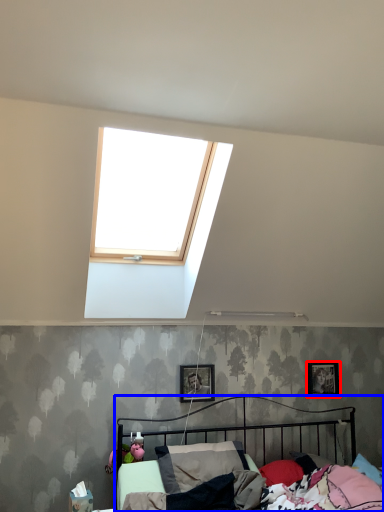
Question: Which of the following is the closest to the observer, picture frame (highlighted by a red box) or bed (highlighted by a blue box)?

Choices:
 (A) picture frame
 (B) bed

Answer: (B)